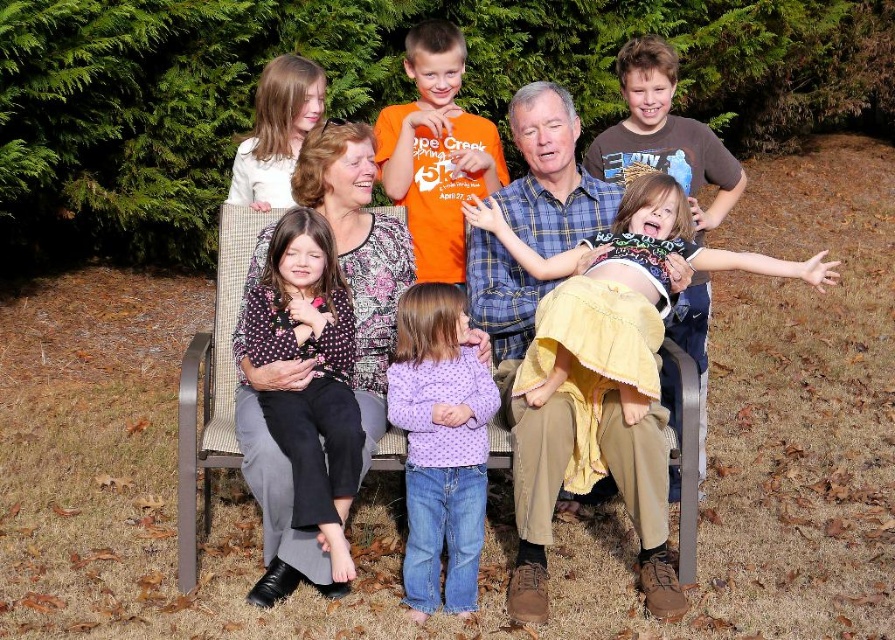
Question: Does polka dot blouse at center come in front of orange cotton shirt at center?

Choices:
 (A) yes
 (B) no

Answer: (A)

Question: Which point appears closest to the camera in this image?

Choices:
 (A) [x=644, y=122]
 (B) [x=273, y=428]
 (C) [x=462, y=364]
 (D) [x=405, y=58]

Answer: (B)

Question: Is matte yellow dress at center positioned in front of yellow lace dress at right?

Choices:
 (A) yes
 (B) no

Answer: (A)

Question: Which is farther from the plaid shirt at center?

Choices:
 (A) polka dot blouse at center
 (B) yellow lace dress at right
 (C) purple dotted sweater at center

Answer: (A)

Question: Which object is farther from the camera taking this photo?

Choices:
 (A) plaid shirt at center
 (B) purple dotted sweater at center

Answer: (B)

Question: Can you confirm if purple dotted sweater at center is positioned above polka dot blouse at center?

Choices:
 (A) no
 (B) yes

Answer: (A)